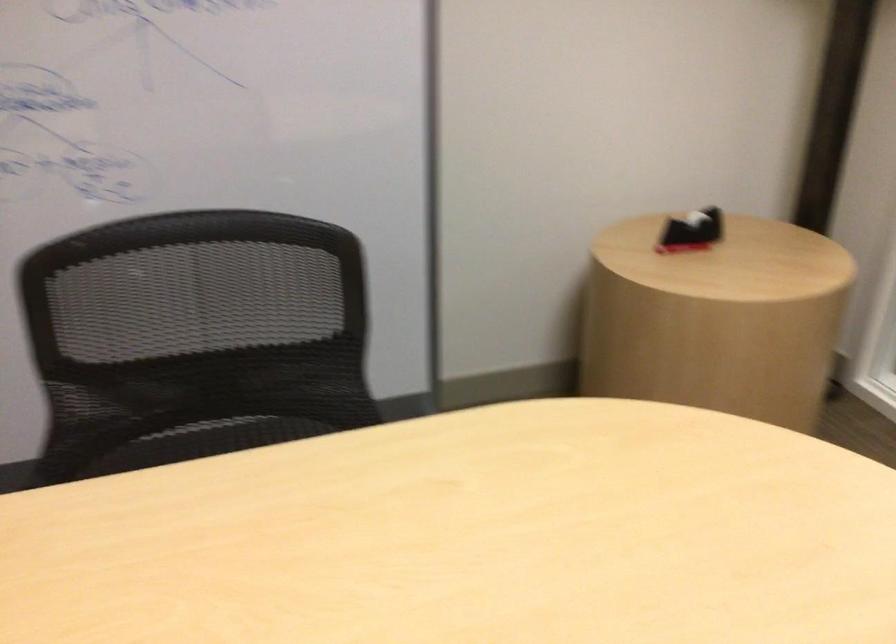
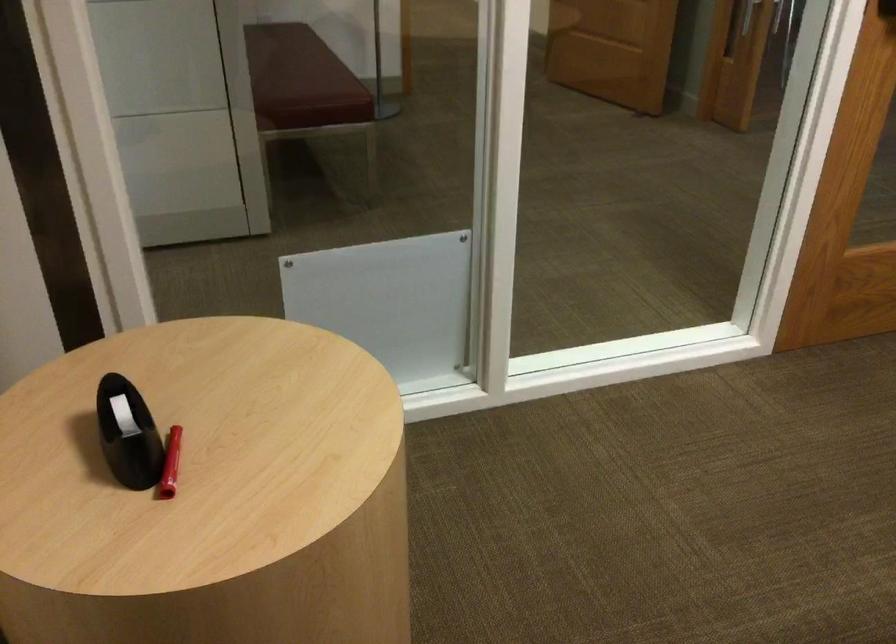
Locate, in the second image, the point that corresponds to the point at 673,219 in the first image.

(127, 433)